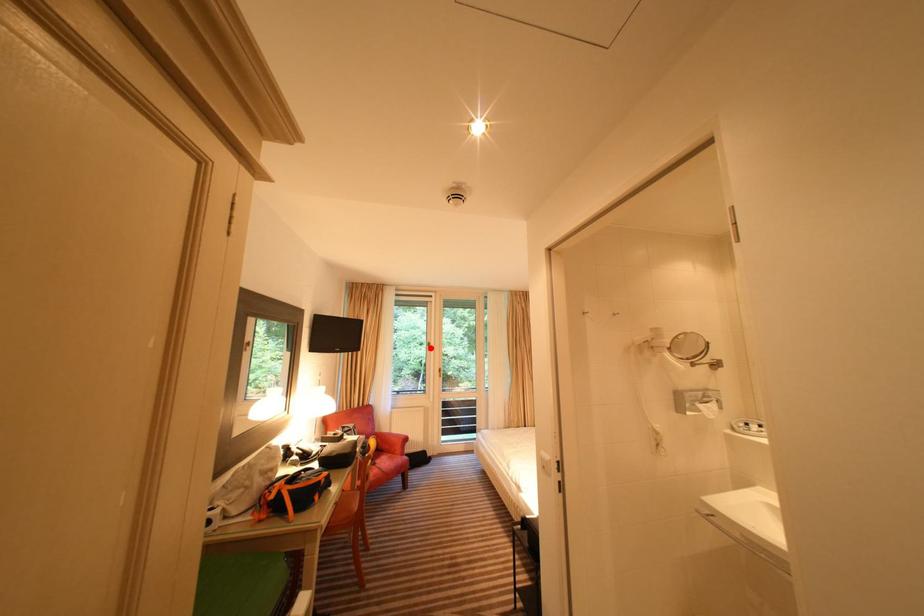
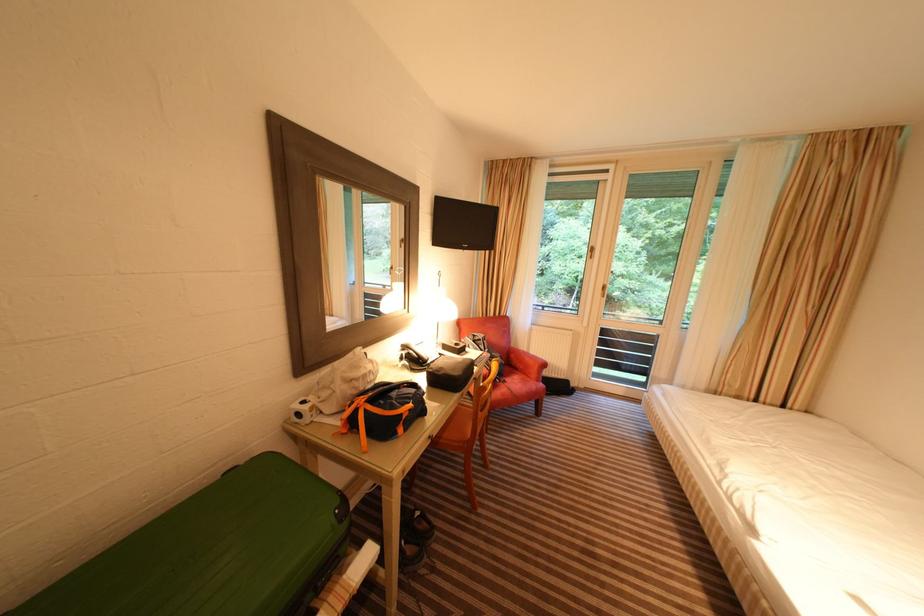
Question: I am providing you with two images of the same scene from different viewpoints. A red point is shown in image1. For the corresponding object point in image2, is it positioned nearer or farther from the camera?

Choices:
 (A) Nearer
 (B) Farther

Answer: (A)